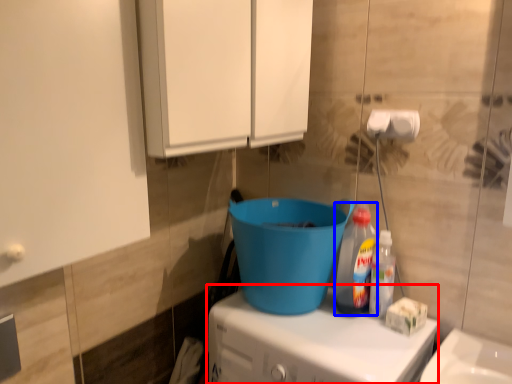
Question: Which object appears closest to the camera in this image, appliance (highlighted by a red box) or bottle (highlighted by a blue box)?

Choices:
 (A) appliance
 (B) bottle

Answer: (A)